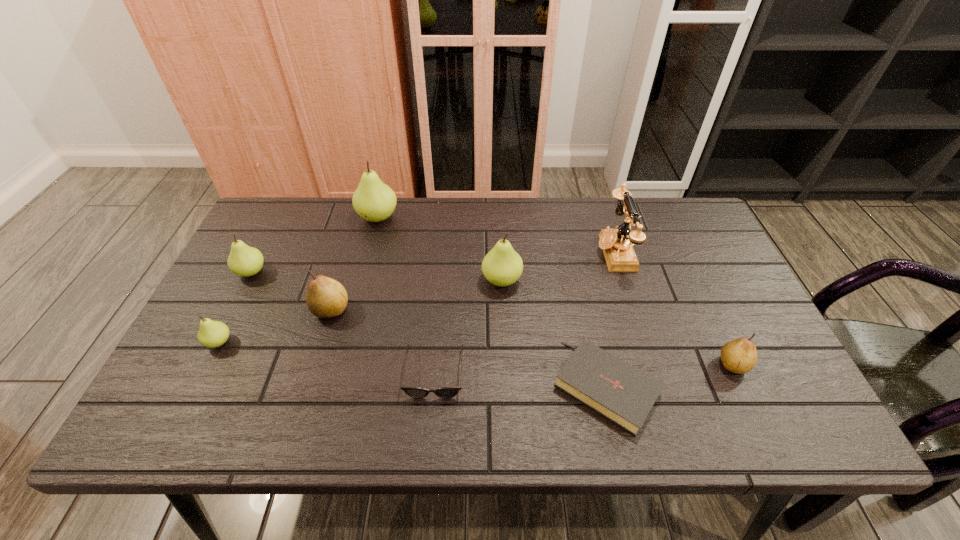
Find the location of a particular element. vacant space located 0.120m on the back of the third biggest green pear is located at coordinates (271, 234).

Identify the location of free space located on the right of the smallest green pear. This screenshot has width=960, height=540. (386, 342).

Where is `free space located 0.320m on the left of the rightmost pear`? free space located 0.320m on the left of the rightmost pear is located at coordinates (580, 364).

Locate an element on the screen. The image size is (960, 540). free space located 0.070m on the front lenses of the fifth object from right to left is located at coordinates (430, 430).

This screenshot has width=960, height=540. Identify the location of vacant space located 0.290m on the back of the Bible. (578, 259).

Where is `pear that is positioned at the far edge`? This screenshot has height=540, width=960. pear that is positioned at the far edge is located at coordinates (x=374, y=201).

This screenshot has height=540, width=960. Identify the location of telephone at the far edge. (616, 244).

Locate an element on the screen. The image size is (960, 540). sunglasses that is at the near edge is located at coordinates click(415, 392).

The image size is (960, 540). Find the location of `Bible positioned at the near edge`. Bible positioned at the near edge is located at coordinates (620, 392).

At what (x,y) coordinates should I click in order to perform the action: click on object present at the right edge. Please return your answer as a coordinate pair (x, y). Looking at the image, I should click on (739, 356).